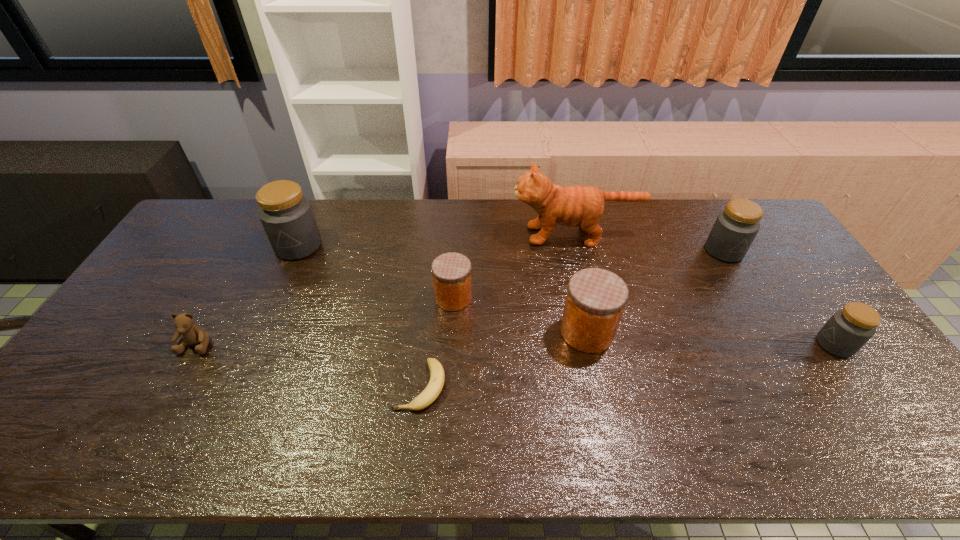
Image resolution: width=960 pixels, height=540 pixels. I want to click on vacant space situated 0.150m on the surface of the second object from right to left near the warning symbol, so (x=752, y=298).

You are a GUI agent. You are given a task and a screenshot of the screen. Output one action in this format:
    pyautogui.click(x=<x>, y=<y>)
    Task: Click on the vacant region located on the left of the third jar from right to left
    
    Given the screenshot: What is the action you would take?
    pyautogui.click(x=503, y=332)

Identify the location of free space located on the right of the left orange jar. The width and height of the screenshot is (960, 540). click(591, 298).

The image size is (960, 540). Find the location of `vacant space positioned 0.140m on the surface of the rightmost gray jar near the warning symbol`. vacant space positioned 0.140m on the surface of the rightmost gray jar near the warning symbol is located at coordinates [x=766, y=345].

Find the location of a particular element. This screenshot has width=960, height=540. vacant space located 0.360m on the surface of the rightmost gray jar near the warning symbol is located at coordinates (686, 345).

Locate an element on the screen. vacant space located on the surface of the rightmost gray jar near the warning symbol is located at coordinates (686, 345).

Where is `free space located 0.280m on the front-facing side of the brown teddy bear`? free space located 0.280m on the front-facing side of the brown teddy bear is located at coordinates (132, 462).

Where is `vacant region located on the right of the yellow banana`? vacant region located on the right of the yellow banana is located at coordinates (564, 386).

The height and width of the screenshot is (540, 960). I want to click on cat located at the far edge, so click(x=572, y=206).

Find the location of `object present at the far right corner`. object present at the far right corner is located at coordinates (735, 228).